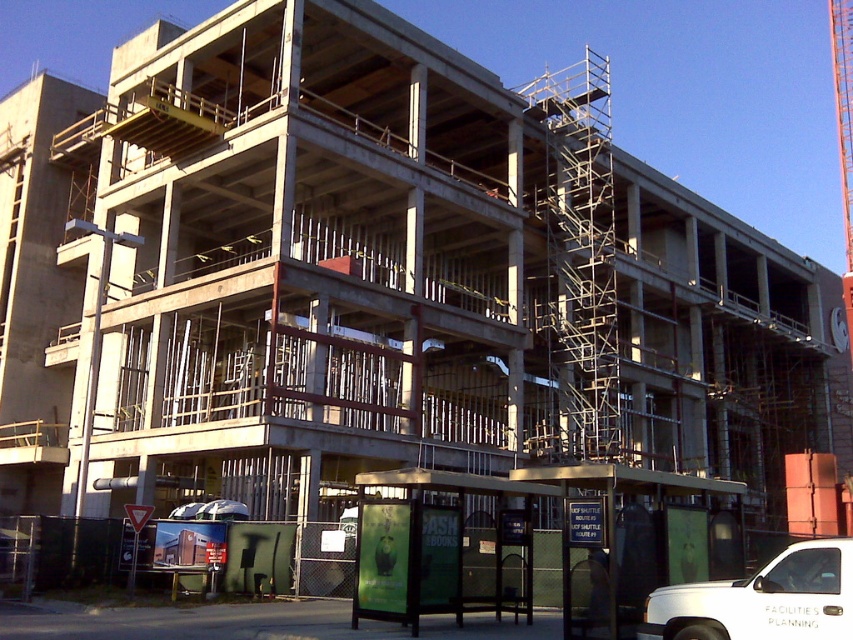
You are a delivery driver who needs to pass through the construction site with your white matte truck at lower right. The orange metallic crane at upper right is in the way. Can your truck go under the crane without hitting it?

The white matte truck at lower right has a lesser height compared to orange metallic crane at upper right, so yes, the truck can pass under the crane without any issues.

You are a delivery driver who needs to park your 2.5 meter wide truck near the construction site. The parking area is between the white matte truck at lower right and the orange metallic crane at upper right. Can your truck fit in this space?

The white matte truck at lower right has a lesser width compared to orange metallic crane at upper right. Since your truck is 2.5 meters wide, and the white matte truck at lower right is narrower, it is likely that the space between them can accommodate your truck as long as there is enough length available. However, the exact fit depends on the combined width of both vehicles and the total space available between them.